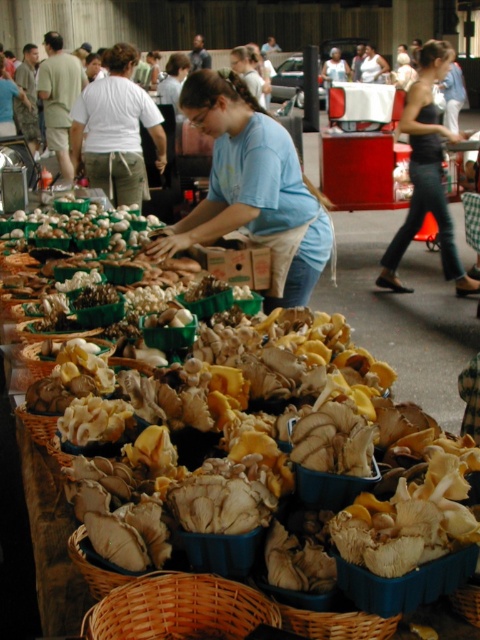
Can you confirm if black denim jeans at lower right is positioned above matte blue shirt at center?

Incorrect, black denim jeans at lower right is not positioned above matte blue shirt at center.

Is black denim jeans at lower right closer to camera compared to matte blue shirt at center?

Yes, black denim jeans at lower right is in front of matte blue shirt at center.

The width and height of the screenshot is (480, 640). I want to click on black denim jeans at lower right, so click(425, 173).

Which is above, woven brown basket at lower center or black denim jeans at lower right?

black denim jeans at lower right

Is woven brown basket at lower center shorter than black denim jeans at lower right?

Yes, woven brown basket at lower center is shorter than black denim jeans at lower right.

Measure the distance between point (239, 609) and camera.

Point (239, 609) is 1.28 meters from camera.

Locate an element on the screen. The width and height of the screenshot is (480, 640). woven brown basket at lower center is located at coordinates (180, 609).

Who is taller, blue cotton shirt at center or woven brown basket at lower center?

blue cotton shirt at center is taller.

Is point (199, 74) closer to camera compared to point (112, 632)?

No.

Describe the element at coordinates (252, 186) in the screenshot. I see `blue cotton shirt at center` at that location.

Where is `blue cotton shirt at center`? Image resolution: width=480 pixels, height=640 pixels. blue cotton shirt at center is located at coordinates (252, 186).